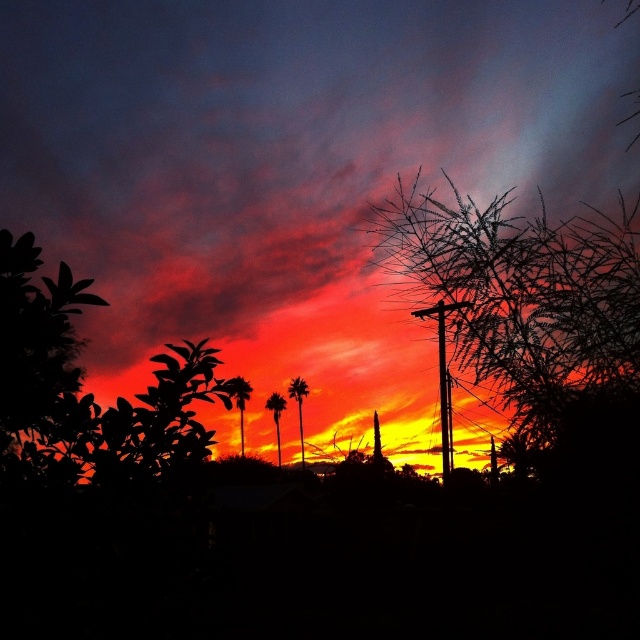
Question: Is bare branches at upper right to the right of green leafy palm tree at center from the viewer's perspective?

Choices:
 (A) yes
 (B) no

Answer: (A)

Question: Which object is the farthest from the silhouette palm tree at center?

Choices:
 (A) orange matte cloud at upper center
 (B) bare branches at upper right

Answer: (B)

Question: Which point is closer to the camera?

Choices:
 (A) (237, 376)
 (B) (292, 378)
 (C) (248, 54)
 (D) (273, 413)

Answer: (A)

Question: Is orange matte cloud at upper center closer to camera compared to green leafy palm tree at center?

Choices:
 (A) no
 (B) yes

Answer: (B)

Question: Among these points, which one is nearest to the camera?

Choices:
 (A) (307, 396)
 (B) (273, 408)
 (C) (486, 308)
 (D) (419, 385)

Answer: (C)

Question: Is green leafy palm tree at center below silhouette palm tree at center?

Choices:
 (A) no
 (B) yes

Answer: (A)